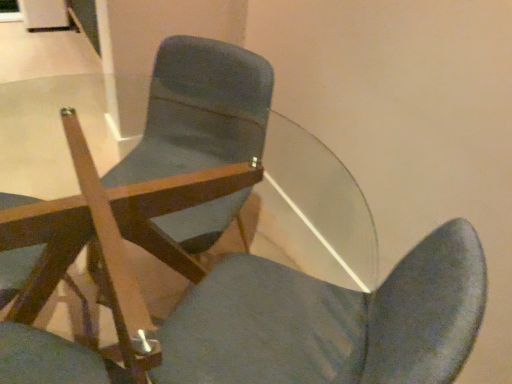
Question: From the image's perspective, is wooden chair at center, which is the 1th chair from left to right, located beneath matte wood chair at center, arranged as the second chair when viewed from the left?

Choices:
 (A) yes
 (B) no

Answer: (A)

Question: Can matte wood chair at center, arranged as the second chair when viewed from the right, be found inside wooden chair at center, which appears as the third chair when viewed from the right?

Choices:
 (A) no
 (B) yes

Answer: (A)

Question: Is wooden chair at center, which appears as the third chair when viewed from the right, bigger than matte wood chair at center, arranged as the second chair when viewed from the right?

Choices:
 (A) yes
 (B) no

Answer: (B)

Question: Is wooden chair at center, which appears as the third chair when viewed from the right, shorter than matte wood chair at center, arranged as the second chair when viewed from the left?

Choices:
 (A) yes
 (B) no

Answer: (B)

Question: Is the position of wooden chair at center, which appears as the third chair when viewed from the right, more distant than that of matte wood chair at center, arranged as the second chair when viewed from the right?

Choices:
 (A) yes
 (B) no

Answer: (A)

Question: From a real-world perspective, is matte wood chair at center, arranged as the second chair when viewed from the left, positioned above or below transparent glass door at upper center?

Choices:
 (A) above
 (B) below

Answer: (A)

Question: Is matte wood chair at center, arranged as the second chair when viewed from the left, situated inside transparent glass door at upper center or outside?

Choices:
 (A) outside
 (B) inside

Answer: (A)

Question: Considering the positions of matte wood chair at center, arranged as the second chair when viewed from the left, and transparent glass door at upper center in the image, is matte wood chair at center, arranged as the second chair when viewed from the left, wider or thinner than transparent glass door at upper center?

Choices:
 (A) wide
 (B) thin

Answer: (A)

Question: Based on their sizes in the image, would you say matte wood chair at center, arranged as the second chair when viewed from the right, is bigger or smaller than transparent glass door at upper center?

Choices:
 (A) small
 (B) big

Answer: (B)

Question: Is matte wood chair at center, the third chair viewed from the left, spatially inside wooden chair at center, which is the 1th chair from left to right, or outside of it?

Choices:
 (A) inside
 (B) outside

Answer: (B)

Question: From the image's perspective, is matte wood chair at center, the third chair viewed from the left, above or below wooden chair at center, which is the 1th chair from left to right?

Choices:
 (A) below
 (B) above

Answer: (B)

Question: Does point (192, 82) appear closer or farther from the camera than point (30, 370)?

Choices:
 (A) farther
 (B) closer

Answer: (A)

Question: From a real-world perspective, is matte wood chair at center, which is the 1th chair from right to left, above or below wooden chair at center, which appears as the third chair when viewed from the right?

Choices:
 (A) below
 (B) above

Answer: (A)

Question: Based on their positions, is matte wood chair at center, the third chair viewed from the left, located to the left or right of transparent glass door at upper center?

Choices:
 (A) left
 (B) right

Answer: (B)

Question: From their relative heights in the image, would you say matte wood chair at center, the third chair viewed from the left, is taller or shorter than transparent glass door at upper center?

Choices:
 (A) tall
 (B) short

Answer: (A)